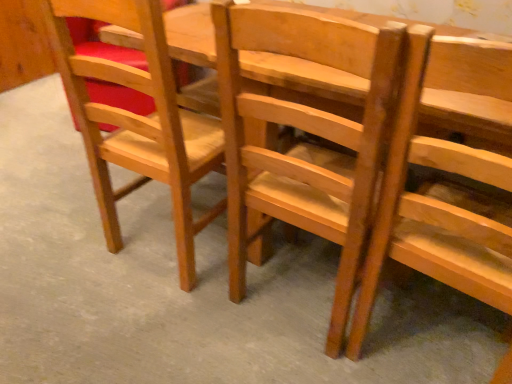
Identify the location of vacant space underneath wooden chair at center, the 3th chair viewed from the left (from a real-world perspective). The height and width of the screenshot is (384, 512). (426, 343).